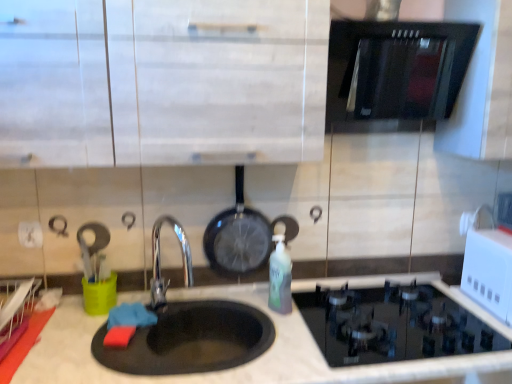
Locate an element on the screen. The width and height of the screenshot is (512, 384). vacant region in front of translucent green bottle at center is located at coordinates (290, 336).